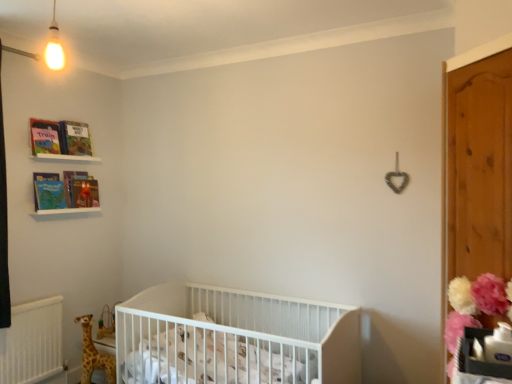
Question: From a real-world perspective, is matte paper book at upper left, the 1th magazine positioned from the back, physically below spotted fabric giraffe at lower left?

Choices:
 (A) yes
 (B) no

Answer: (B)

Question: Is matte paper book at upper left, the 1th magazine positioned from the back, behind spotted fabric giraffe at lower left?

Choices:
 (A) no
 (B) yes

Answer: (B)

Question: Considering the relative sizes of matte paper book at upper left, which is counted as the 2th magazine, starting from the front, and spotted fabric giraffe at lower left in the image provided, is matte paper book at upper left, which is counted as the 2th magazine, starting from the front, thinner than spotted fabric giraffe at lower left?

Choices:
 (A) yes
 (B) no

Answer: (A)

Question: Is matte paper book at upper left, which ranks as the 2th magazine in top-to-bottom order, turned away from spotted fabric giraffe at lower left?

Choices:
 (A) yes
 (B) no

Answer: (B)

Question: Are matte paper book at upper left, which ranks as the 2th magazine in top-to-bottom order, and spotted fabric giraffe at lower left located far from each other?

Choices:
 (A) no
 (B) yes

Answer: (B)

Question: In terms of width, does white matte crib at center look wider or thinner when compared to matte paper book at upper left, the 1th magazine positioned from the back?

Choices:
 (A) wide
 (B) thin

Answer: (A)

Question: In terms of height, does white matte crib at center look taller or shorter compared to matte paper book at upper left, which is counted as the 2th magazine, starting from the front?

Choices:
 (A) short
 (B) tall

Answer: (B)

Question: From the image's perspective, is white matte crib at center located above or below matte paper book at upper left, which is counted as the 2th magazine, starting from the front?

Choices:
 (A) below
 (B) above

Answer: (A)

Question: Would you say white matte crib at center is inside or outside matte paper book at upper left, the 1th magazine positioned from the back?

Choices:
 (A) outside
 (B) inside

Answer: (A)

Question: Is point (66, 157) closer or farther from the camera than point (78, 177)?

Choices:
 (A) closer
 (B) farther

Answer: (A)

Question: Is white plastic crib at upper left, arranged as the second balustrade when ordered from the bottom, taller or shorter than matte paper book at upper left, which ranks as the 2th magazine in top-to-bottom order?

Choices:
 (A) short
 (B) tall

Answer: (A)

Question: Visually, is white plastic crib at upper left, arranged as the second balustrade when ordered from the bottom, positioned to the left or to the right of matte paper book at upper left, positioned as the 1th magazine in bottom-to-top order?

Choices:
 (A) right
 (B) left

Answer: (B)

Question: Relative to matte paper book at upper left, which ranks as the 2th magazine in top-to-bottom order, is white plastic crib at upper left, arranged as the second balustrade when ordered from the bottom, in front or behind?

Choices:
 (A) behind
 (B) front

Answer: (B)

Question: Is matte cardboard book at upper left, arranged as the second book when ordered from the bottom, in front of or behind white plastic crib at upper left, positioned as the 1th balustrade in top-to-bottom order, in the image?

Choices:
 (A) behind
 (B) front

Answer: (A)

Question: Is point [x=82, y=145] closer or farther from the camera than point [x=51, y=158]?

Choices:
 (A) farther
 (B) closer

Answer: (A)